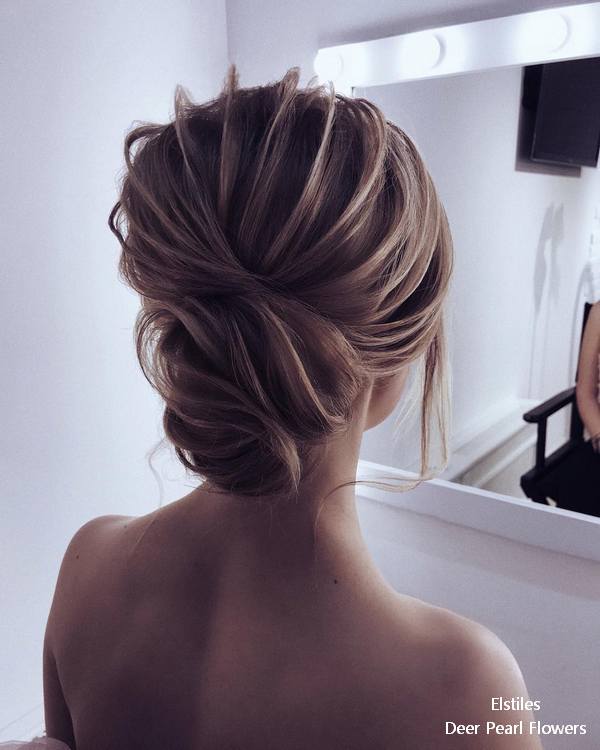
Identify the location of black chair. tap(558, 469).